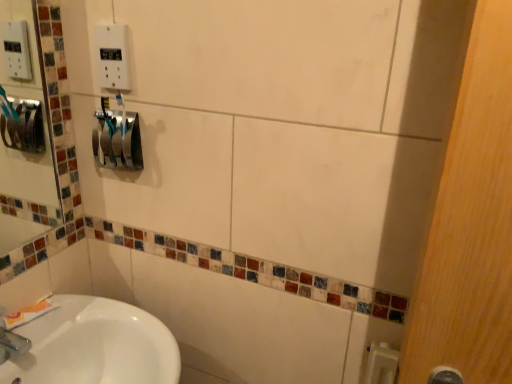
Question: Considering the relative positions of blue glossy toothbrush at center-left and white matte toothpaste at lower left in the image provided, is blue glossy toothbrush at center-left to the right of white matte toothpaste at lower left from the viewer's perspective?

Choices:
 (A) no
 (B) yes

Answer: (B)

Question: Is blue glossy toothbrush at center-left closer to the viewer compared to white matte toothpaste at lower left?

Choices:
 (A) yes
 (B) no

Answer: (A)

Question: Is blue glossy toothbrush at center-left further to the viewer compared to white matte toothpaste at lower left?

Choices:
 (A) yes
 (B) no

Answer: (B)

Question: Is blue glossy toothbrush at center-left taller than white matte toothpaste at lower left?

Choices:
 (A) yes
 (B) no

Answer: (A)

Question: Can you confirm if blue glossy toothbrush at center-left is shorter than white matte toothpaste at lower left?

Choices:
 (A) no
 (B) yes

Answer: (A)

Question: Based on their sizes in the image, would you say white matte toothpaste at lower left is bigger or smaller than white plastic outlet at upper center?

Choices:
 (A) big
 (B) small

Answer: (A)

Question: Is white matte toothpaste at lower left situated inside white plastic outlet at upper center or outside?

Choices:
 (A) inside
 (B) outside

Answer: (B)

Question: From the image's perspective, is white matte toothpaste at lower left above or below white plastic outlet at upper center?

Choices:
 (A) above
 (B) below

Answer: (B)

Question: Considering the relative positions of white matte toothpaste at lower left and white plastic outlet at upper center in the image provided, is white matte toothpaste at lower left to the left or to the right of white plastic outlet at upper center?

Choices:
 (A) right
 (B) left

Answer: (B)

Question: From the image's perspective, relative to blue glossy toothbrush at center-left, is white matte toothpaste at lower left above or below?

Choices:
 (A) below
 (B) above

Answer: (A)

Question: Is white matte toothpaste at lower left situated inside blue glossy toothbrush at center-left or outside?

Choices:
 (A) inside
 (B) outside

Answer: (B)

Question: From a real-world perspective, relative to blue glossy toothbrush at center-left, is white matte toothpaste at lower left vertically above or below?

Choices:
 (A) above
 (B) below

Answer: (B)

Question: Is white matte toothpaste at lower left taller or shorter than blue glossy toothbrush at center-left?

Choices:
 (A) tall
 (B) short

Answer: (B)

Question: From a real-world perspective, relative to blue glossy toothbrush at center-left, is white plastic outlet at upper center vertically above or below?

Choices:
 (A) above
 (B) below

Answer: (A)

Question: Considering the positions of white plastic outlet at upper center and blue glossy toothbrush at center-left in the image, is white plastic outlet at upper center taller or shorter than blue glossy toothbrush at center-left?

Choices:
 (A) short
 (B) tall

Answer: (A)